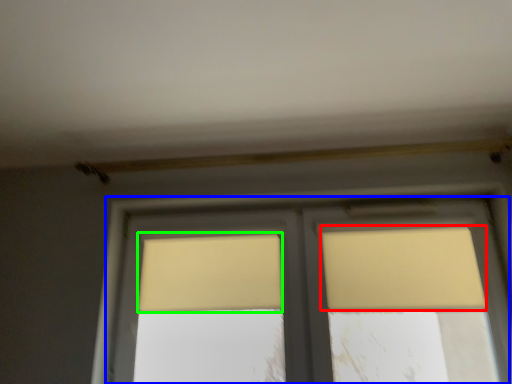
Question: Which object is the closest to the curtain (highlighted by a red box)? Choose among these: window (highlighted by a blue box) or curtain (highlighted by a green box).

Choices:
 (A) window
 (B) curtain

Answer: (A)